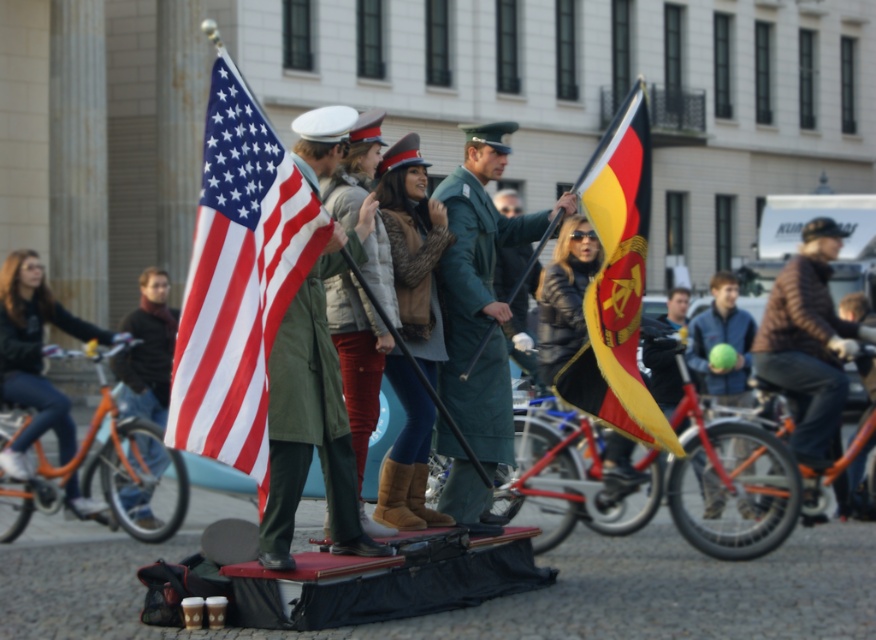
Question: Which point appears farthest from the camera in this image?

Choices:
 (A) (366, 358)
 (B) (219, 221)
 (C) (326, 444)

Answer: (A)

Question: From the image, what is the correct spatial relationship of leather jacket at center in relation to green matte uniform at center?

Choices:
 (A) left
 (B) right

Answer: (B)

Question: Is dark gray sweater at left positioned at the back of leather jacket at center?

Choices:
 (A) yes
 (B) no

Answer: (A)

Question: Based on their relative distances, which object is farther from the leather boots at center?

Choices:
 (A) red-white striped fabric flag at left
 (B) green military uniform at center
 (C) matte green coat at center

Answer: (A)

Question: Is orange matte bicycle at left closer to the viewer compared to dark gray sweater at left?

Choices:
 (A) no
 (B) yes

Answer: (B)

Question: Among these objects, which one is farthest from the camera?

Choices:
 (A) dark gray sweater at left
 (B) red matte bicycle at center

Answer: (A)